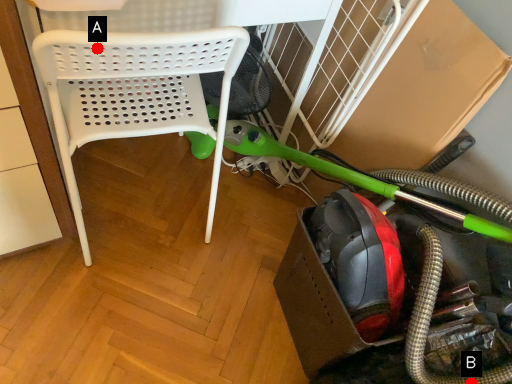
Question: Two points are circled on the image, labeled by A and B beside each circle. Which point is farther to the camera?

Choices:
 (A) A is further
 (B) B is further

Answer: (B)